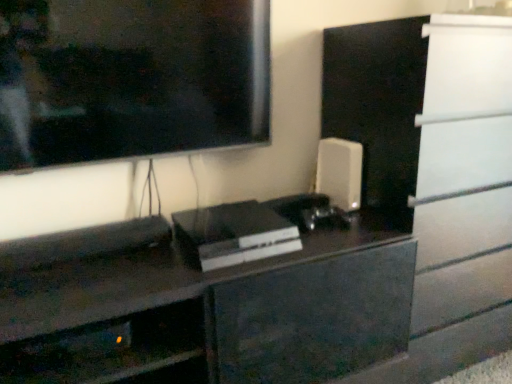
Question: From the image's perspective, is white matte speaker at right, which is counted as the 2th appliance, starting from the front, located above or below sleek black console at center, arranged as the 1th appliance when viewed from the left?

Choices:
 (A) above
 (B) below

Answer: (A)

Question: Considering the positions of white matte speaker at right, which is counted as the 2th appliance, starting from the front, and sleek black console at center, which appears as the 2th appliance when viewed from the back, in the image, is white matte speaker at right, which is counted as the 2th appliance, starting from the front, wider or thinner than sleek black console at center, which appears as the 2th appliance when viewed from the back,?

Choices:
 (A) thin
 (B) wide

Answer: (A)

Question: Which is nearer to the metallic gray shelf at lower left?

Choices:
 (A) white matte speaker at right, the first appliance from the back
 (B) sleek black console at center, the 2th appliance in the right-to-left sequence

Answer: (B)

Question: Based on their relative distances, which object is farther from the white matte speaker at right, marked as the second appliance in a left-to-right arrangement?

Choices:
 (A) sleek black console at center, which appears as the 2th appliance when viewed from the back
 (B) metallic gray shelf at lower left

Answer: (B)